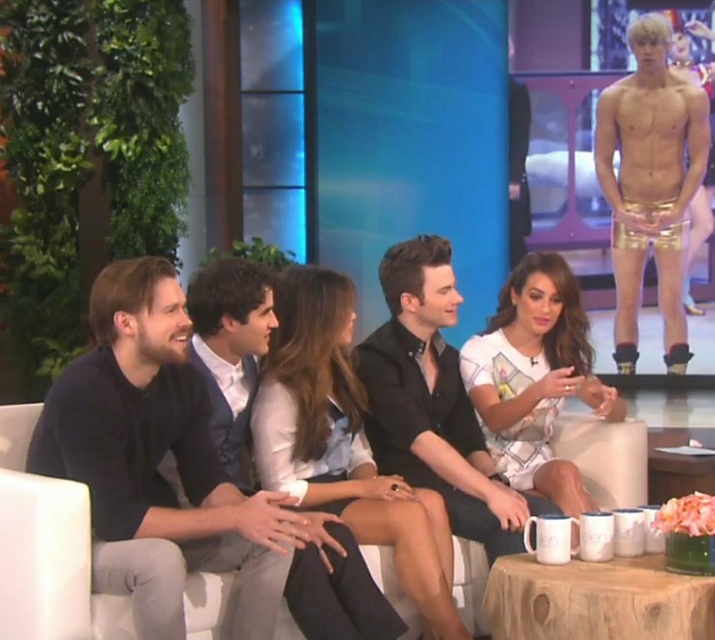
Question: Among these objects, which one is nearest to the camera?

Choices:
 (A) gold metallic shorts at upper right
 (B) dark blue suit at center

Answer: (B)

Question: Does black satin shirt at center appear on the right side of dark blue suit at center?

Choices:
 (A) yes
 (B) no

Answer: (A)

Question: Which of these objects is positioned farthest from the white printed dress at center?

Choices:
 (A) white cotton shirt at center
 (B) gold metallic shorts at upper right

Answer: (B)

Question: Which point is closer to the camera?

Choices:
 (A) white printed dress at center
 (B) white fabric couch at center

Answer: (B)

Question: Observing the image, what is the correct spatial positioning of black satin shirt at center in reference to dark blue suit at center?

Choices:
 (A) left
 (B) right

Answer: (B)

Question: Can you confirm if white fabric couch at center is positioned above dark blue suit at center?

Choices:
 (A) no
 (B) yes

Answer: (A)